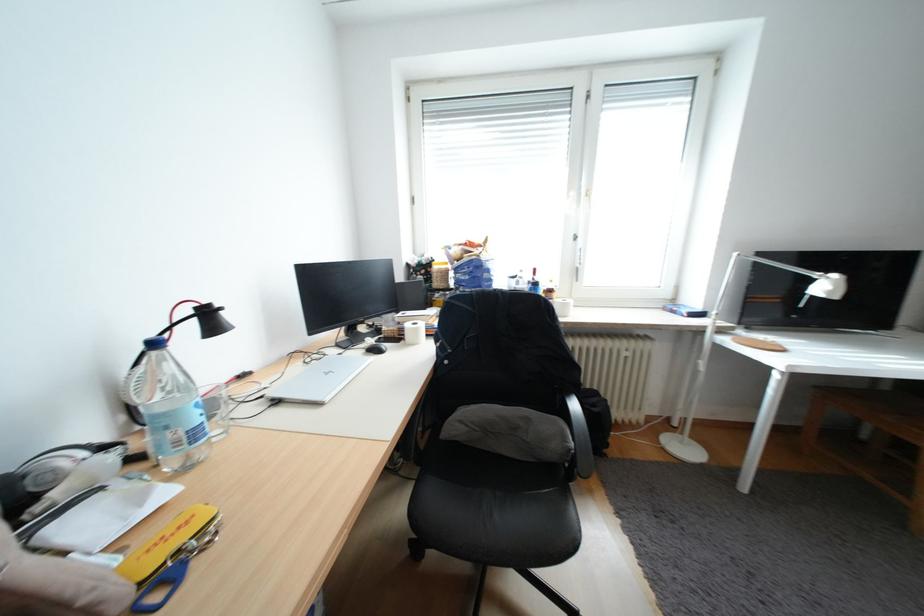
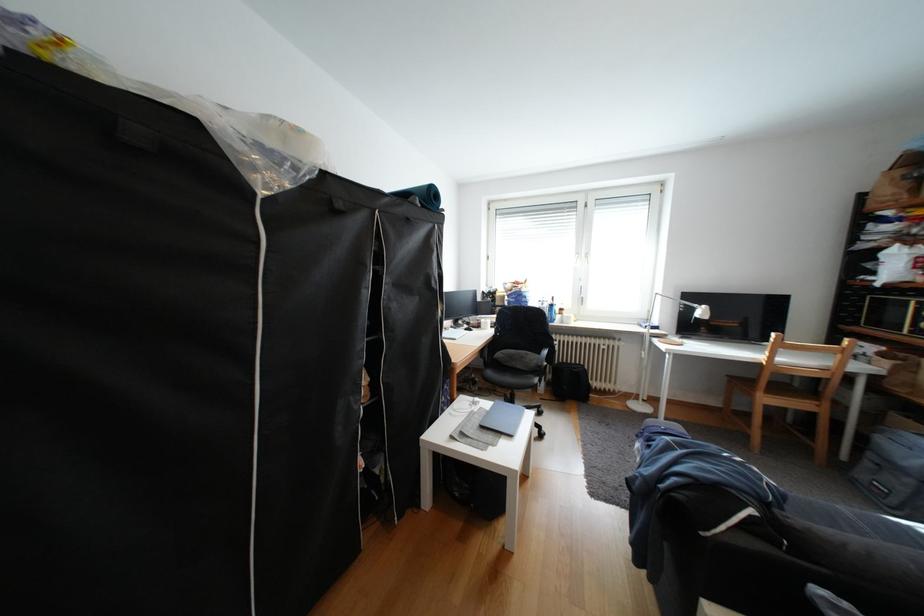
Question: Which direction would the cameraman need to move to produce the second image? Reply with the corresponding letter.

Choices:
 (A) Left
 (B) Right
 (C) Forward
 (D) Backward

Answer: (D)